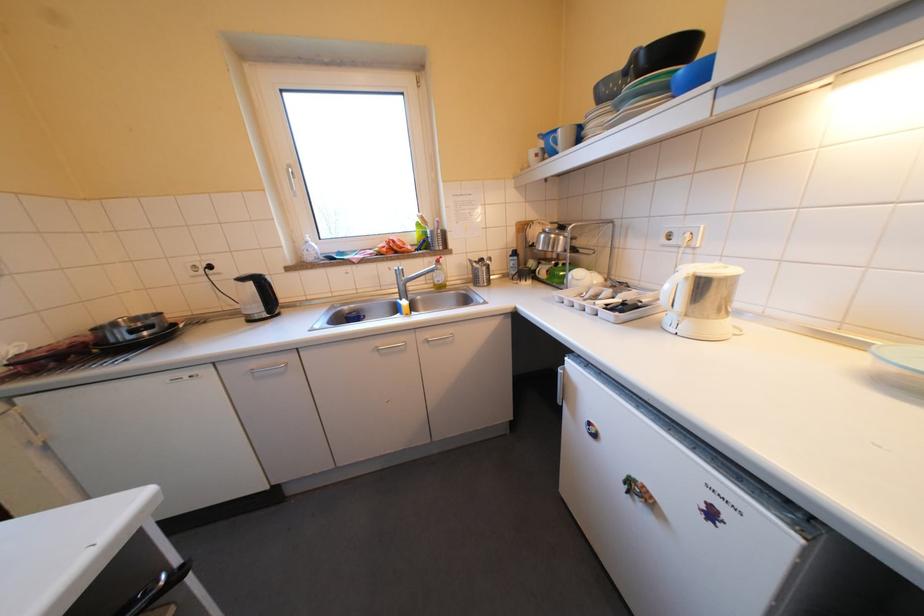
Find where to press the bottle pump top. Please return your answer as a coordinate pair (x, y).

(310, 251)